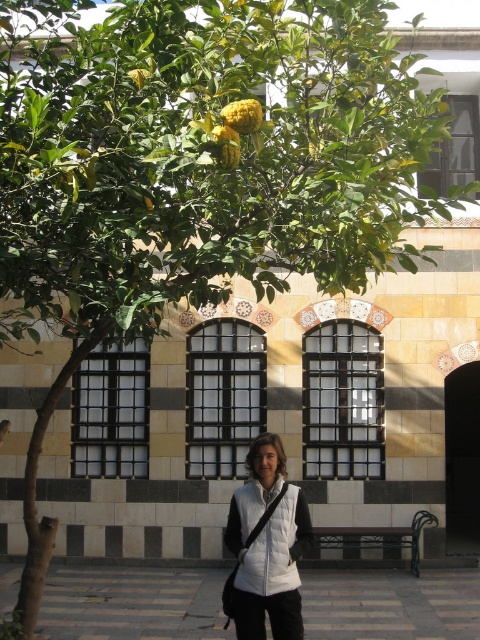
Question: Among these objects, which one is farthest from the camera?

Choices:
 (A) smooth stone pavement at center
 (B) white puffer vest at center

Answer: (A)

Question: Can you confirm if smooth stone pavement at center is positioned to the right of white puffer vest at center?

Choices:
 (A) no
 (B) yes

Answer: (B)

Question: Does smooth stone pavement at center come behind white puffer vest at center?

Choices:
 (A) yes
 (B) no

Answer: (A)

Question: Is smooth stone pavement at center to the right of white puffer vest at center from the viewer's perspective?

Choices:
 (A) no
 (B) yes

Answer: (B)

Question: Among these objects, which one is nearest to the camera?

Choices:
 (A) smooth stone pavement at center
 (B) white puffer vest at center

Answer: (B)